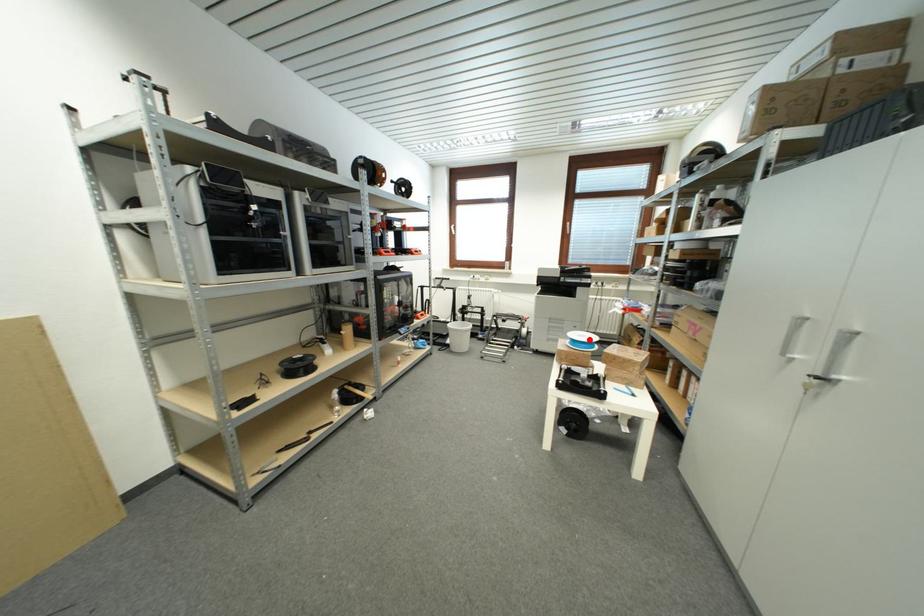
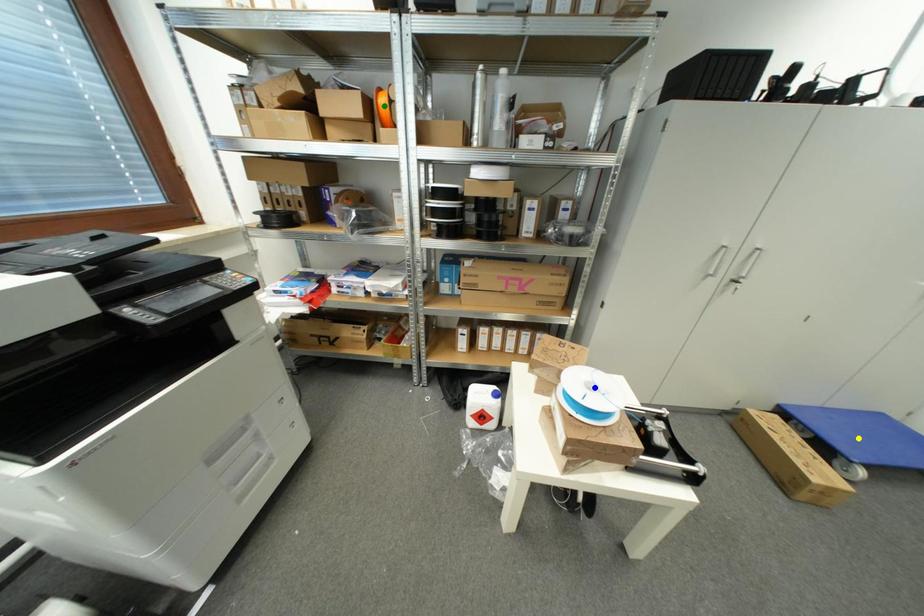
Question: I am providing you with two images of the same scene from different viewpoints. A red point is marked on the first image. You are given multiple points on the second image. Can you choose the point in image 2 that corresponds to the point in image 1?

Choices:
 (A) green point
 (B) blue point
 (C) yellow point

Answer: (B)